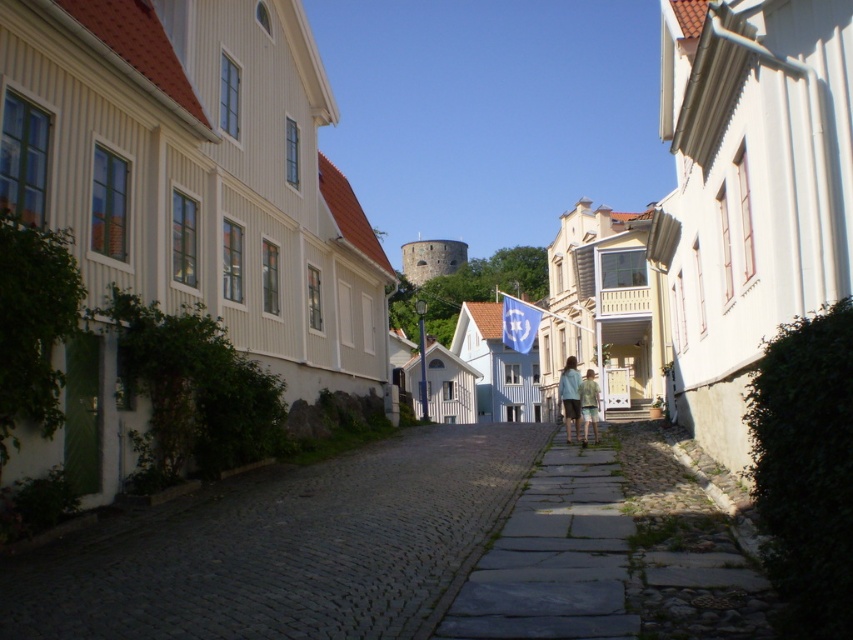
Question: Considering the real-world distances, which object is closest to the blue denim shorts at center?

Choices:
 (A) green cotton shorts at center
 (B) gray stone path at center

Answer: (A)

Question: Can you confirm if gray stone path at center is wider than green cotton shorts at center?

Choices:
 (A) yes
 (B) no

Answer: (B)

Question: Can you confirm if gray stone path at center is bigger than green cotton shorts at center?

Choices:
 (A) yes
 (B) no

Answer: (B)

Question: Which is nearer to the green cotton shorts at center?

Choices:
 (A) blue denim shorts at center
 (B) gray stone path at center

Answer: (A)

Question: Does gray stone path at center have a larger size compared to blue denim shorts at center?

Choices:
 (A) yes
 (B) no

Answer: (B)

Question: Which point is farther to the camera?

Choices:
 (A) (593, 403)
 (B) (598, 618)
 (C) (572, 410)

Answer: (C)